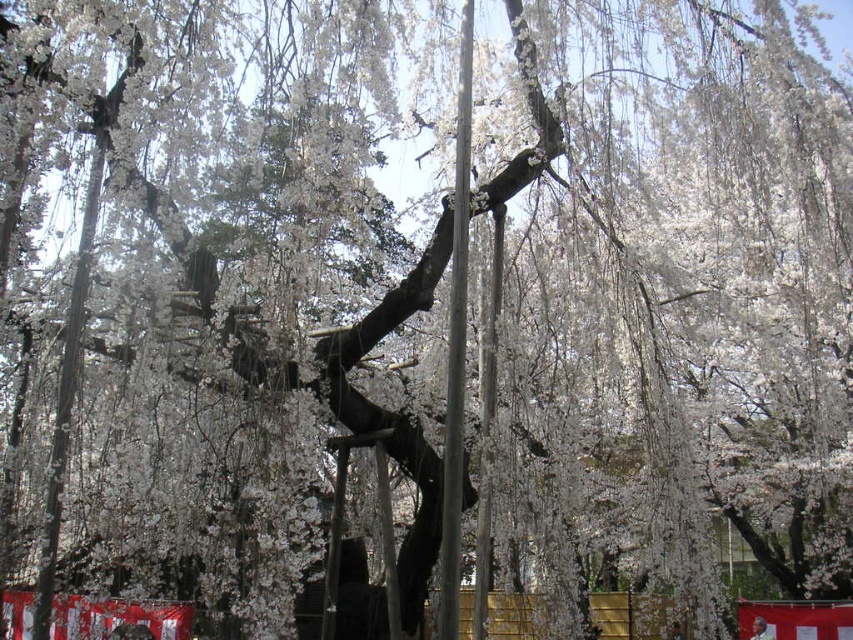
You are standing at the center of the image and want to reach the metallic pole at center. Which direction should you move to reach it?

The metallic pole at center is already at the center of the image, so you don not need to move in any direction to reach it.